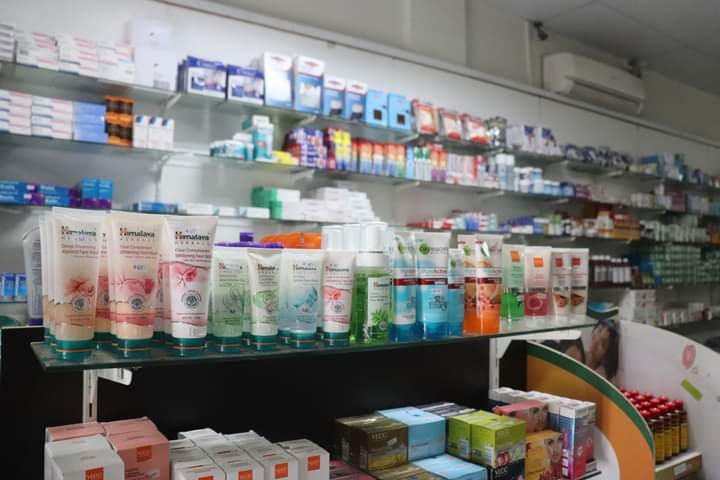
This screenshot has height=480, width=720. What are the coordinates of `black shelf` in the screenshot? It's located at click(x=302, y=387).